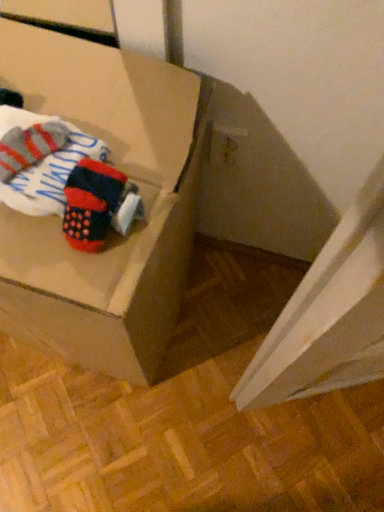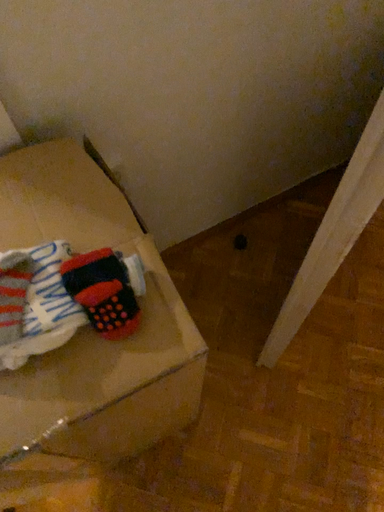
Question: Which way did the camera rotate in the video?

Choices:
 (A) rotated left
 (B) rotated right

Answer: (B)